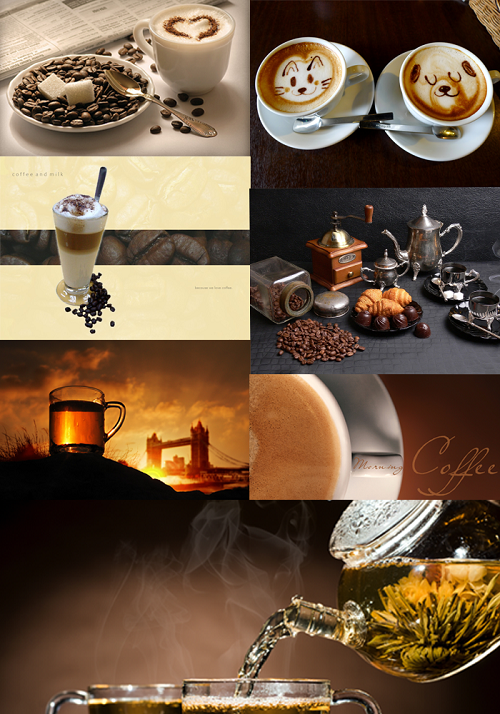
Find the location of a particular element. This screenshot has height=714, width=500. cup is located at coordinates (195, 58), (285, 111), (420, 115), (74, 422), (324, 395), (278, 690), (132, 690), (455, 278), (478, 308).